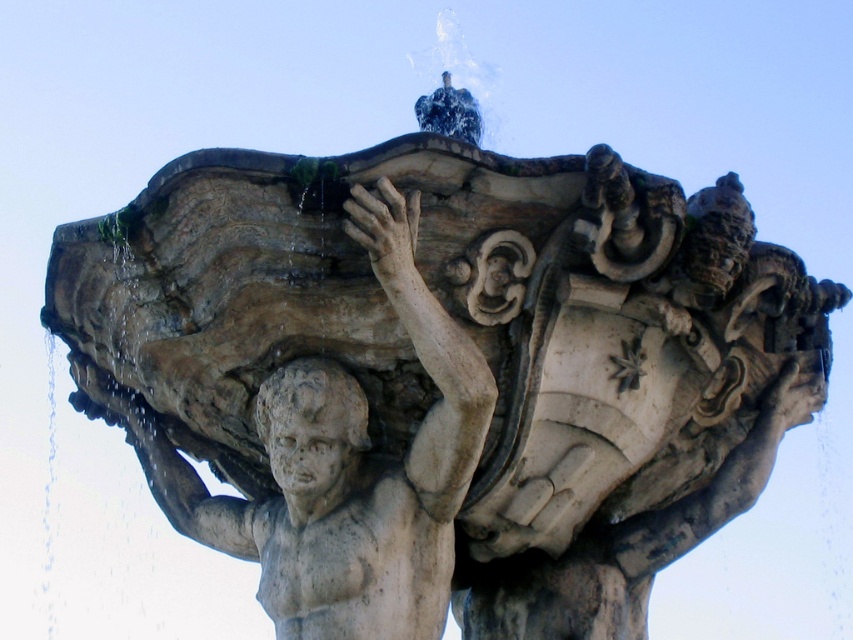
Question: Does white stone cherub at center have a smaller size compared to stone head at center?

Choices:
 (A) no
 (B) yes

Answer: (A)

Question: Is white stone cherub at center bigger than stone head at center?

Choices:
 (A) yes
 (B) no

Answer: (A)

Question: Which of the following is the closest to the observer?

Choices:
 (A) stone head at center
 (B) white stone cherub at center

Answer: (B)

Question: Does white stone cherub at center come behind stone head at center?

Choices:
 (A) no
 (B) yes

Answer: (A)